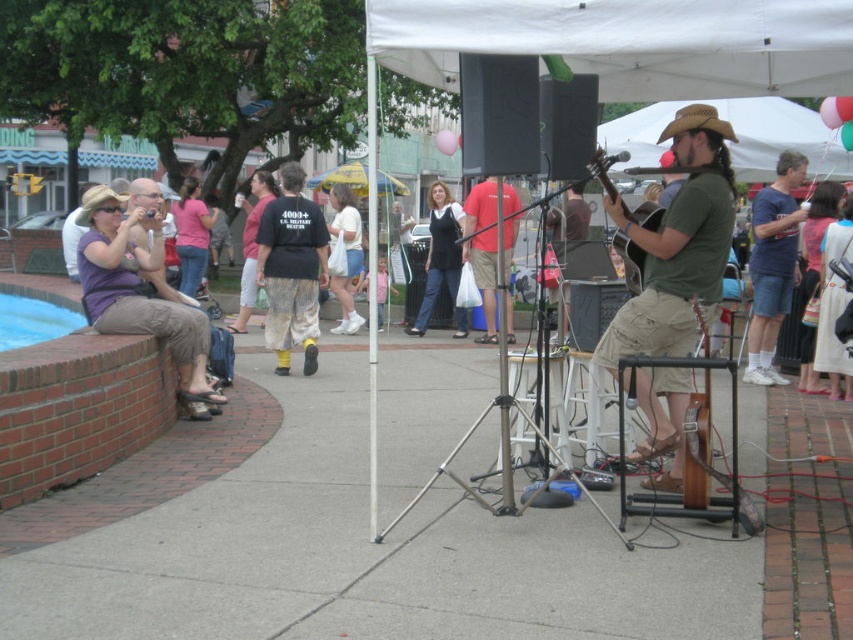
You are standing at the point labeled point (296,164) and want to walk to the point labeled point (204,228). Which direction should you move to get closer to your destination?

To move from point (296,164) to point (204,228), you should move towards the upper right direction since point (296,164) is closer to the viewer than point (204,228).